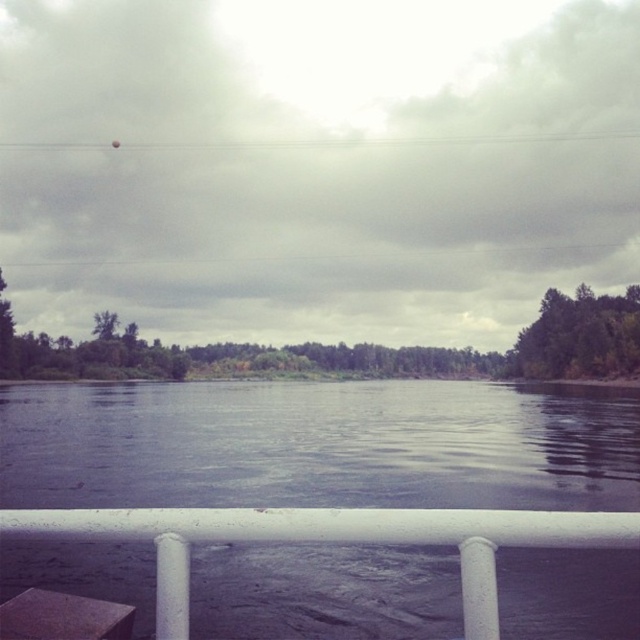
You are standing on the boat with the white railing in the foreground. You want to point to the green matte tree at right. Where should you look relative to your position?

The green matte tree at right is located at the coordinates 0.527 on the x axis and 0.906 on the y axis, so you should look towards the upper right direction from your position on the boat.

You are on a boat with a white railing in front of you. You see two points marked in the scene. Which point is closer to you, point [609,358] or point [97,326]?

Point [609,358] is closer to you because it is in front of point [97,326].